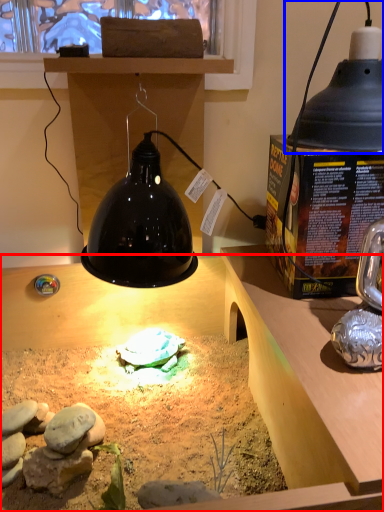
Question: Among these objects, which one is nearest to the camera, desk (highlighted by a red box) or lamp (highlighted by a blue box)?

Choices:
 (A) desk
 (B) lamp

Answer: (A)